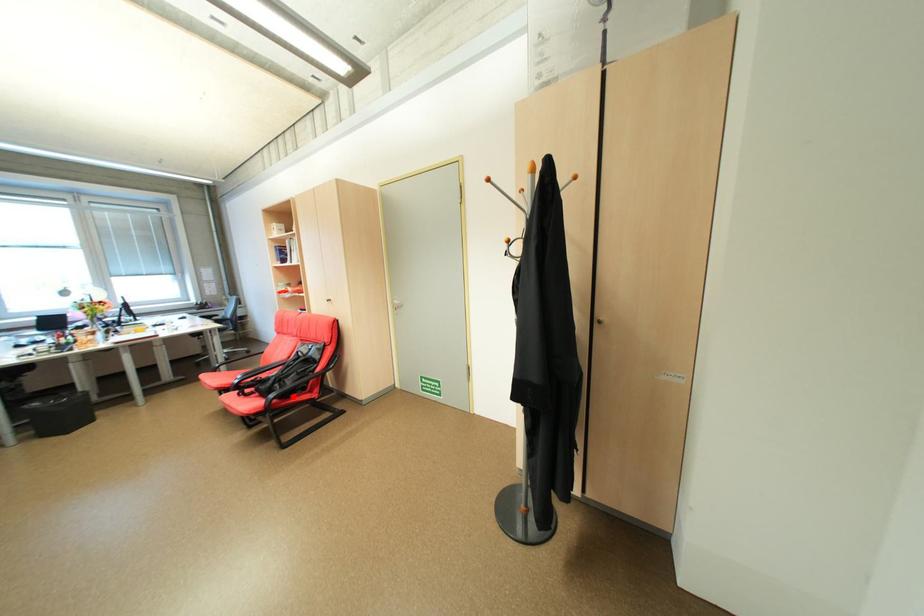
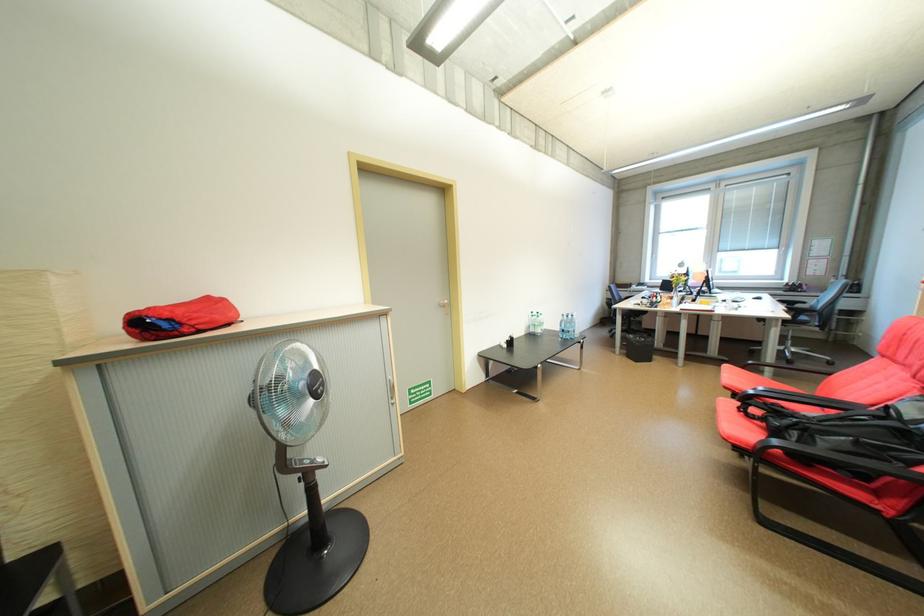
The point at the highlighted location is marked in the first image. Where is the corresponding point in the second image?

(809, 458)